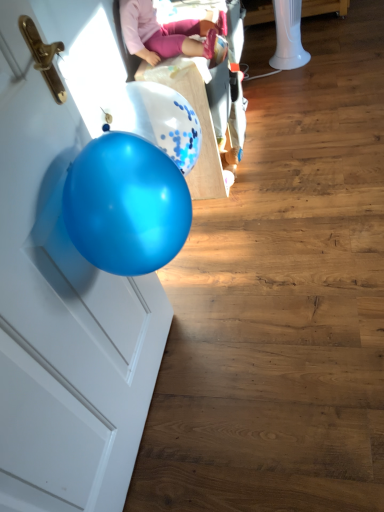
This screenshot has width=384, height=512. Find the location of `vacant region in front of glossy blue balloon at left`. vacant region in front of glossy blue balloon at left is located at coordinates (196, 468).